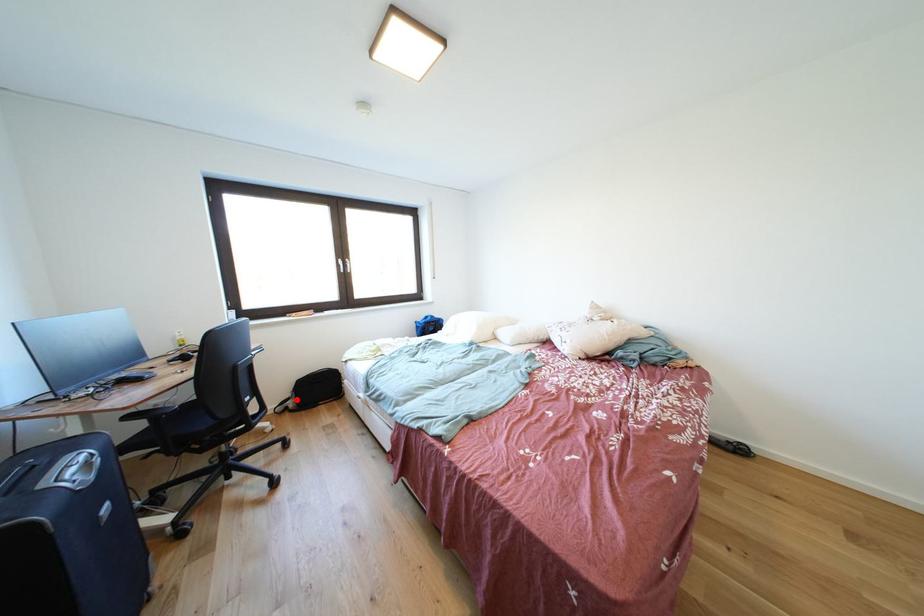
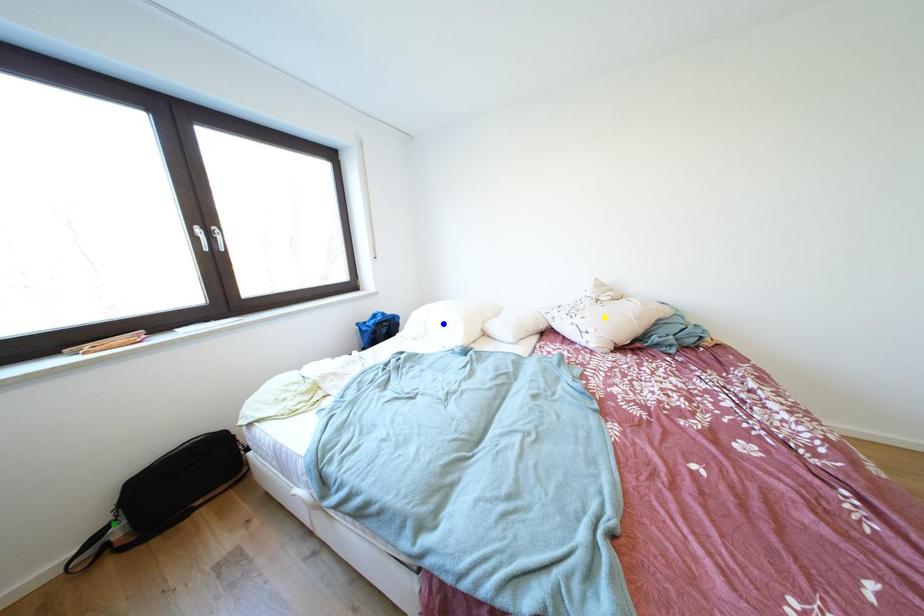
Question: I am providing you with two images of the same scene from different viewpoints. A red point is marked on the first image. You are given multiple points on the second image. Which point in image 2 represents the same 3d spot as the red point in image 1?

Choices:
 (A) blue point
 (B) yellow point
 (C) green point

Answer: (C)